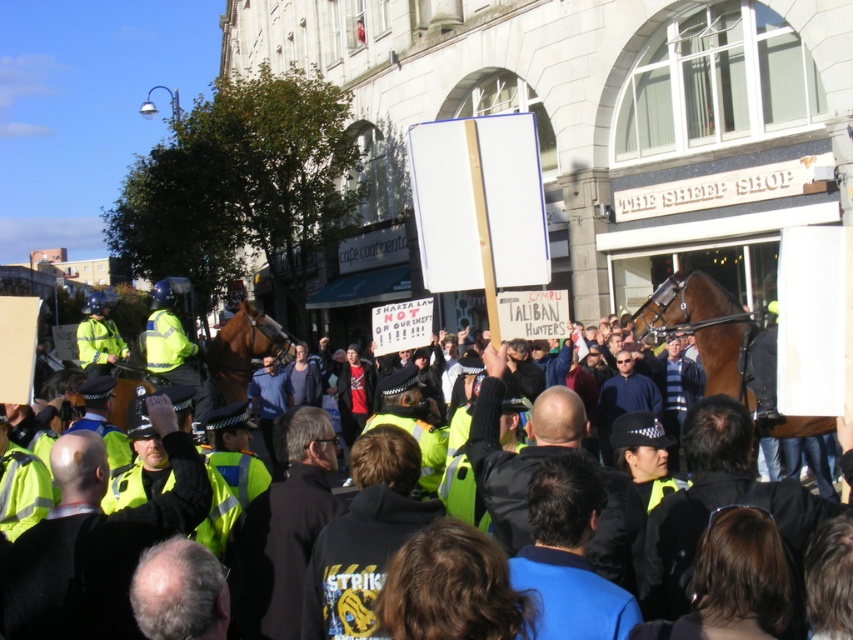
You are a protestor standing at the edge of the crowd. You see the yellow reflective vest at center. Can you estimate its position in the image using coordinates?

The yellow reflective vest at center is located at coordinates approximately 0.844 on the x axis and 0.114 on the y axis.